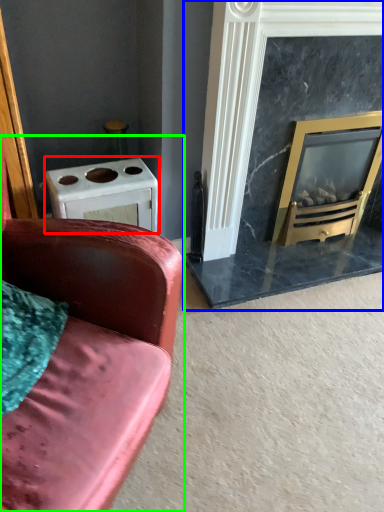
Question: Which is farther away from appliance (highlighted by a red box)? fireplace (highlighted by a blue box) or studio couch (highlighted by a green box)?

Choices:
 (A) fireplace
 (B) studio couch

Answer: (A)